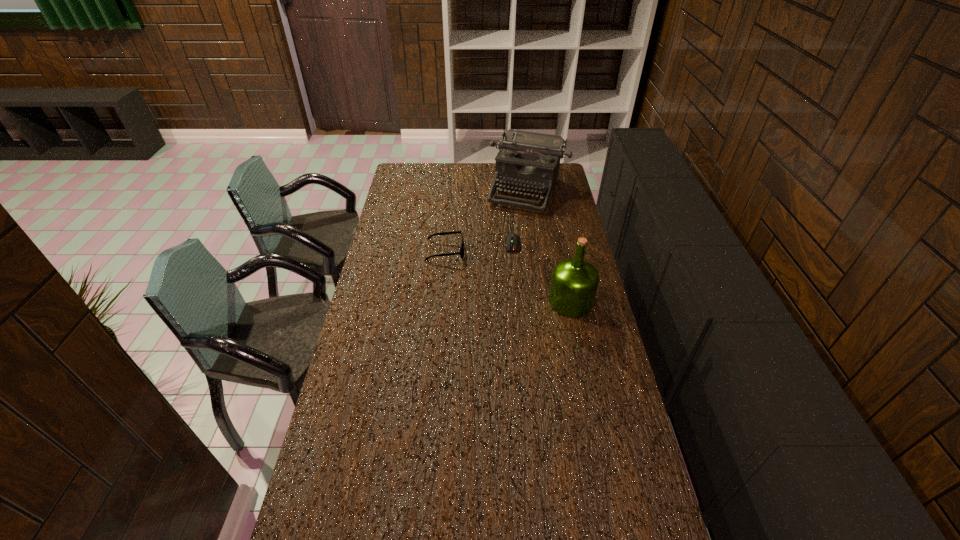
Locate an element on the screen. The image size is (960, 540). free space at the near edge is located at coordinates (440, 516).

You are a GUI agent. You are given a task and a screenshot of the screen. Output one action in this format:
    pyautogui.click(x=<x>, y=<y>)
    Task: Click on the free spot at the left edge of the desktop
    
    Given the screenshot: What is the action you would take?
    pyautogui.click(x=421, y=189)

You are a GUI agent. You are given a task and a screenshot of the screen. Output one action in this format:
    pyautogui.click(x=<x>, y=<y>)
    Task: Click on the vacant point at the right edge
    This screenshot has height=540, width=960.
    Given the screenshot: What is the action you would take?
    pyautogui.click(x=558, y=220)

Find the location of a particular element. vacant space at the far left corner is located at coordinates (412, 168).

This screenshot has width=960, height=540. In the image, there is a desktop. What are the coordinates of `free space at the far right corner` in the screenshot? It's located at (564, 178).

At what (x,y) coordinates should I click in order to perform the action: click on blank space at the near right corner of the desktop. Please return your answer as a coordinate pair (x, y). Looking at the image, I should click on (613, 518).

The height and width of the screenshot is (540, 960). Find the location of `free spot between the shortest object and the tallest object`. free spot between the shortest object and the tallest object is located at coordinates (541, 273).

Where is `vacant space in between the computer equipment and the farthest object`? vacant space in between the computer equipment and the farthest object is located at coordinates (520, 217).

Locate an element on the screen. free space that is in between the nearest object and the typewriter is located at coordinates (549, 246).

This screenshot has width=960, height=540. I want to click on unoccupied area between the sunglasses and the typewriter, so click(x=487, y=220).